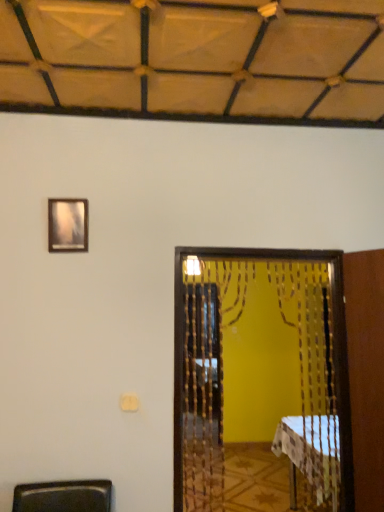
Question: Is wooden beaded screen door at center inside white checkered tablecloth at lower right?

Choices:
 (A) no
 (B) yes

Answer: (A)

Question: From a real-world perspective, is white checkered tablecloth at lower right on wooden beaded screen door at center?

Choices:
 (A) yes
 (B) no

Answer: (B)

Question: Would you consider white checkered tablecloth at lower right to be distant from wooden beaded screen door at center?

Choices:
 (A) yes
 (B) no

Answer: (B)

Question: From the image's perspective, is white checkered tablecloth at lower right on top of wooden beaded screen door at center?

Choices:
 (A) no
 (B) yes

Answer: (A)

Question: Is white checkered tablecloth at lower right positioned with its back to wooden beaded screen door at center?

Choices:
 (A) yes
 (B) no

Answer: (B)

Question: Considering the positions of wooden frame at upper left and white checkered tablecloth at lower right in the image, is wooden frame at upper left taller or shorter than white checkered tablecloth at lower right?

Choices:
 (A) tall
 (B) short

Answer: (B)

Question: Based on their sizes in the image, would you say wooden frame at upper left is bigger or smaller than white checkered tablecloth at lower right?

Choices:
 (A) small
 (B) big

Answer: (A)

Question: From the image's perspective, is wooden frame at upper left located above or below white checkered tablecloth at lower right?

Choices:
 (A) above
 (B) below

Answer: (A)

Question: From a real-world perspective, is wooden frame at upper left positioned above or below white checkered tablecloth at lower right?

Choices:
 (A) below
 (B) above

Answer: (B)

Question: In terms of size, does wooden frame at upper left appear bigger or smaller than wooden beaded screen door at center?

Choices:
 (A) big
 (B) small

Answer: (B)

Question: Is wooden frame at upper left in front of or behind wooden beaded screen door at center in the image?

Choices:
 (A) behind
 (B) front

Answer: (A)

Question: From a real-world perspective, is wooden frame at upper left physically located above or below wooden beaded screen door at center?

Choices:
 (A) below
 (B) above

Answer: (B)

Question: Considering the positions of point (71, 205) and point (213, 366), is point (71, 205) closer or farther from the camera than point (213, 366)?

Choices:
 (A) farther
 (B) closer

Answer: (B)

Question: Would you say wooden beaded screen door at center is to the left or to the right of wooden frame at upper left in the picture?

Choices:
 (A) right
 (B) left

Answer: (A)

Question: In the image, is wooden beaded screen door at center positioned in front of or behind wooden frame at upper left?

Choices:
 (A) front
 (B) behind

Answer: (A)